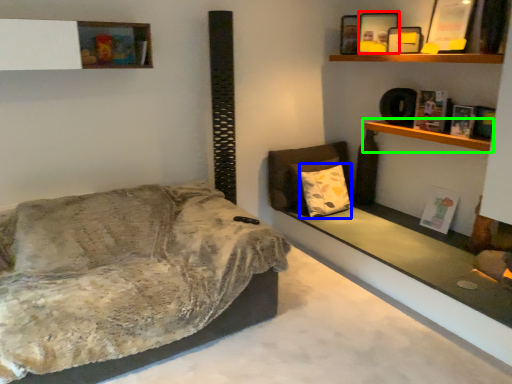
Question: Which is nearer to the picture frame (highlighted by a red box)? pillow (highlighted by a blue box) or shelf (highlighted by a green box).

Choices:
 (A) pillow
 (B) shelf

Answer: (B)